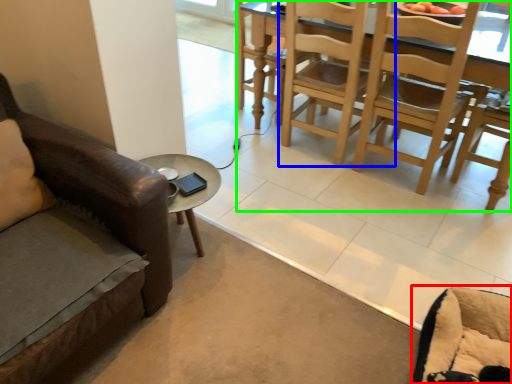
Question: Which is farther away from swivel chair (highlighted by a red box)? chair (highlighted by a blue box) or kitchen & dining room table (highlighted by a green box)?

Choices:
 (A) chair
 (B) kitchen & dining room table

Answer: (A)